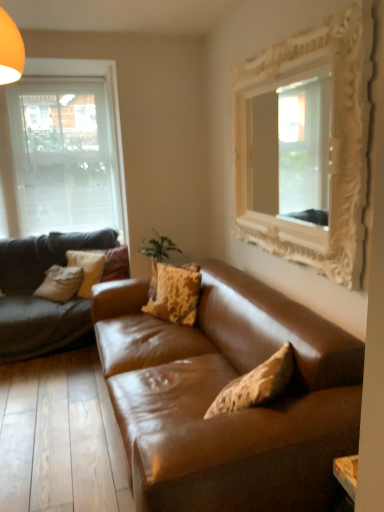
Question: Is the position of camouflage-patterned fabric pillow at center, which is counted as the first pillow, starting from the front, less distant than that of camouflage-patterned fabric pillow at center, which appears as the 2th pillow when viewed from the right?

Choices:
 (A) no
 (B) yes

Answer: (B)

Question: Is camouflage-patterned fabric pillow at center, which is counted as the first pillow, starting from the front, to the right of camouflage-patterned fabric pillow at center, acting as the first pillow starting from the back, from the viewer's perspective?

Choices:
 (A) no
 (B) yes

Answer: (B)

Question: Does camouflage-patterned fabric pillow at center, the third pillow in the left-to-right sequence, appear on the left side of camouflage-patterned fabric pillow at center, acting as the first pillow starting from the back?

Choices:
 (A) yes
 (B) no

Answer: (B)

Question: Are camouflage-patterned fabric pillow at center, which appears as the first pillow when viewed from the right, and camouflage-patterned fabric pillow at center, the second pillow positioned from the left, located far from each other?

Choices:
 (A) yes
 (B) no

Answer: (B)

Question: Is camouflage-patterned fabric pillow at center, which is counted as the first pillow, starting from the front, further to the viewer compared to camouflage-patterned fabric pillow at center, marked as the third pillow in a front-to-back arrangement?

Choices:
 (A) no
 (B) yes

Answer: (A)

Question: Is point (192, 280) closer or farther from the camera than point (81, 285)?

Choices:
 (A) farther
 (B) closer

Answer: (B)

Question: Is camouflage-patterned fabric pillow at center, acting as the third pillow starting from the back, to the left or to the right of camouflage-patterned fabric pillow at center-left, which ranks as the second pillow in back-to-front order, in the image?

Choices:
 (A) right
 (B) left

Answer: (A)

Question: Relative to camouflage-patterned fabric pillow at center-left, which ranks as the 1th pillow in left-to-right order, is camouflage-patterned fabric pillow at center, which is counted as the first pillow, starting from the front, in front or behind?

Choices:
 (A) front
 (B) behind

Answer: (A)

Question: From a real-world perspective, is camouflage-patterned fabric pillow at center, the third pillow in the left-to-right sequence, physically located above or below camouflage-patterned fabric pillow at center-left, the second pillow from the front?

Choices:
 (A) above
 (B) below

Answer: (A)

Question: Is camouflage-patterned fabric pillow at center, marked as the third pillow in a front-to-back arrangement, bigger or smaller than white ornate mirror at upper right?

Choices:
 (A) big
 (B) small

Answer: (B)

Question: Is camouflage-patterned fabric pillow at center, the second pillow positioned from the left, taller or shorter than white ornate mirror at upper right?

Choices:
 (A) tall
 (B) short

Answer: (B)

Question: Considering the positions of point (117, 254) and point (246, 93), is point (117, 254) closer or farther from the camera than point (246, 93)?

Choices:
 (A) closer
 (B) farther

Answer: (B)

Question: Would you say camouflage-patterned fabric pillow at center, acting as the first pillow starting from the back, is to the left or to the right of white ornate mirror at upper right in the picture?

Choices:
 (A) left
 (B) right

Answer: (A)

Question: Is point (294, 463) closer or farther from the camera than point (104, 189)?

Choices:
 (A) closer
 (B) farther

Answer: (A)

Question: Considering the positions of brown leather couch at center and transparent glass window at left in the image, is brown leather couch at center wider or thinner than transparent glass window at left?

Choices:
 (A) thin
 (B) wide

Answer: (B)